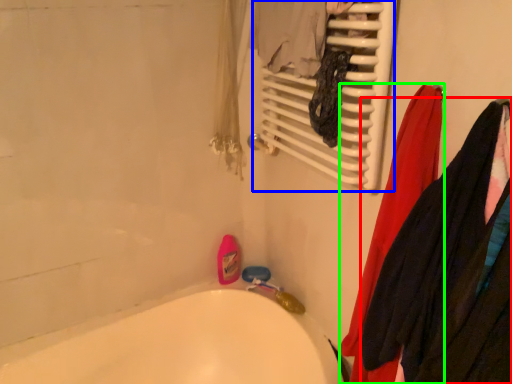
Question: Estimate the real-world distances between objects in this image. Which object is farther from clothing (highlighted by a red box), radiator (highlighted by a blue box) or clothing (highlighted by a green box)?

Choices:
 (A) radiator
 (B) clothing

Answer: (A)